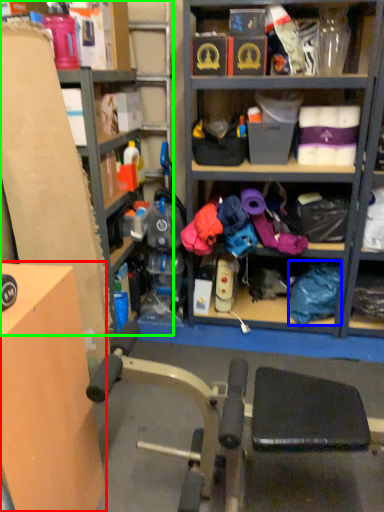
Question: Which object is positioned farthest from table (highlighted by a red box)? Select from clothing (highlighted by a blue box) and shelf (highlighted by a green box).

Choices:
 (A) clothing
 (B) shelf

Answer: (A)